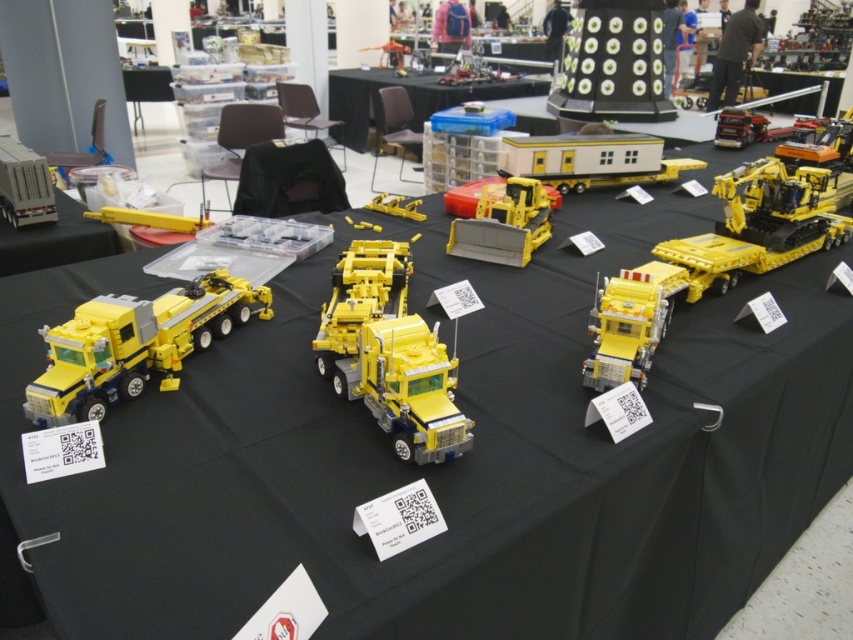
Is black plastic target at upper right to the right of yellow plastic truck at center from the viewer's perspective?

Indeed, black plastic target at upper right is positioned on the right side of yellow plastic truck at center.

Which is in front, point (648, 120) or point (616, 321)?

Positioned in front is point (616, 321).

This screenshot has width=853, height=640. Find the location of `black plastic target at upper right`. black plastic target at upper right is located at coordinates (614, 64).

Between shiny yellow truck at center and matte yellow construction vehicle at center, which one is positioned higher?

matte yellow construction vehicle at center is higher up.

Is shiny yellow truck at center shorter than matte yellow construction vehicle at center?

Incorrect, shiny yellow truck at center's height does not fall short of matte yellow construction vehicle at center's.

Measure the distance between point [370,241] and camera.

5.55 feet

Identify the location of shiny yellow truck at center. (360, 296).

Does yellow plastic trailer at upper right appear on the right side of shiny yellow truck at center?

Correct, you'll find yellow plastic trailer at upper right to the right of shiny yellow truck at center.

Who is taller, yellow plastic trailer at upper right or shiny yellow truck at center?

Standing taller between the two is yellow plastic trailer at upper right.

Is point (619, 140) farther from camera compared to point (366, 314)?

That is True.

Where is `yellow plastic trailer at upper right`? yellow plastic trailer at upper right is located at coordinates (590, 157).